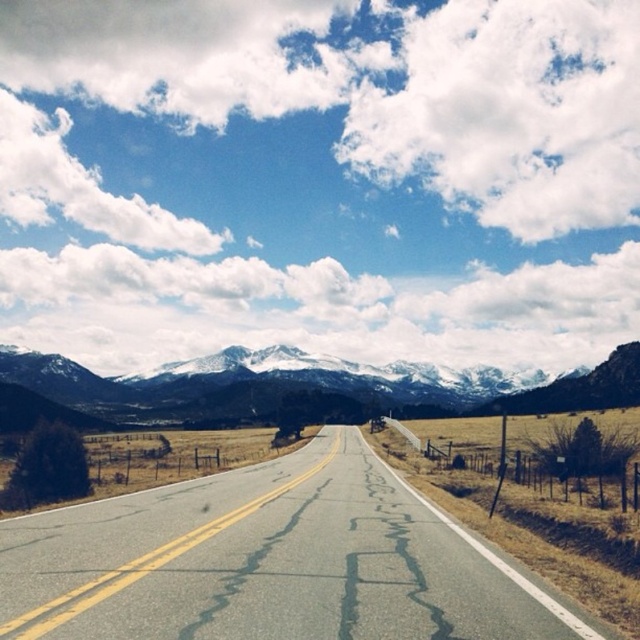
Which is behind, point (128, 596) or point (125, 406)?

The point (125, 406) is more distant.

Who is positioned more to the right, asphalt road at center or snowy granite mountains at center?

asphalt road at center is more to the right.

Does point (273, 625) lie behind point (120, 420)?

No.

This screenshot has height=640, width=640. I want to click on asphalt road at center, so click(x=269, y=561).